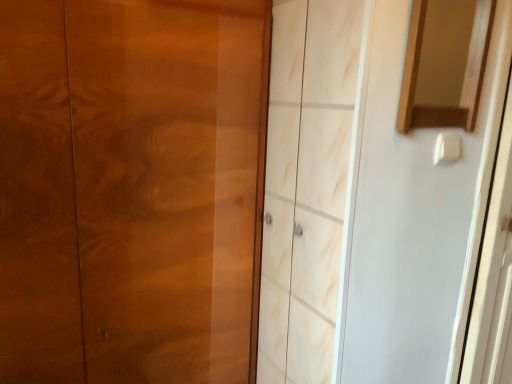
Question: From the image's perspective, would you say glossy wood door at left is shown under wooden mirror at upper right?

Choices:
 (A) no
 (B) yes

Answer: (B)

Question: Is glossy wood door at left at the left side of wooden mirror at upper right?

Choices:
 (A) no
 (B) yes

Answer: (B)

Question: Can you confirm if glossy wood door at left is shorter than wooden mirror at upper right?

Choices:
 (A) no
 (B) yes

Answer: (A)

Question: Is wooden mirror at upper right completely or partially inside glossy wood door at left?

Choices:
 (A) yes
 (B) no

Answer: (B)

Question: Is glossy wood door at left at the right side of wooden mirror at upper right?

Choices:
 (A) no
 (B) yes

Answer: (A)

Question: Do you think wooden mirror at upper right is within white glossy screen door at right, or outside of it?

Choices:
 (A) inside
 (B) outside

Answer: (B)

Question: From the image's perspective, is wooden mirror at upper right positioned above or below white glossy screen door at right?

Choices:
 (A) above
 (B) below

Answer: (A)

Question: In the image, is wooden mirror at upper right positioned in front of or behind white glossy screen door at right?

Choices:
 (A) behind
 (B) front

Answer: (B)

Question: Is wooden mirror at upper right wider or thinner than white glossy screen door at right?

Choices:
 (A) thin
 (B) wide

Answer: (A)

Question: Considering the positions of wooden mirror at upper right and glossy wood door at left in the image, is wooden mirror at upper right taller or shorter than glossy wood door at left?

Choices:
 (A) tall
 (B) short

Answer: (B)

Question: Considering the positions of wooden mirror at upper right and glossy wood door at left in the image, is wooden mirror at upper right bigger or smaller than glossy wood door at left?

Choices:
 (A) small
 (B) big

Answer: (A)

Question: Is point (417, 56) closer or farther from the camera than point (118, 41)?

Choices:
 (A) farther
 (B) closer

Answer: (B)

Question: Would you say wooden mirror at upper right is to the left or to the right of glossy wood door at left in the picture?

Choices:
 (A) right
 (B) left

Answer: (A)

Question: From the image's perspective, relative to wooden mirror at upper right, is glossy wood door at left above or below?

Choices:
 (A) below
 (B) above

Answer: (A)

Question: Relative to wooden mirror at upper right, is glossy wood door at left in front or behind?

Choices:
 (A) behind
 (B) front

Answer: (B)